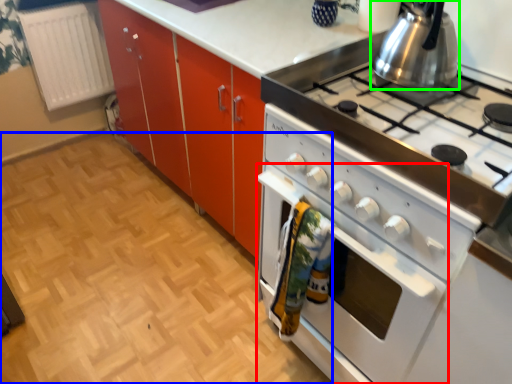
Question: Which is nearer to the oven (highlighted by a red box)? plain (highlighted by a blue box) or kitchen appliance (highlighted by a green box).

Choices:
 (A) plain
 (B) kitchen appliance

Answer: (B)